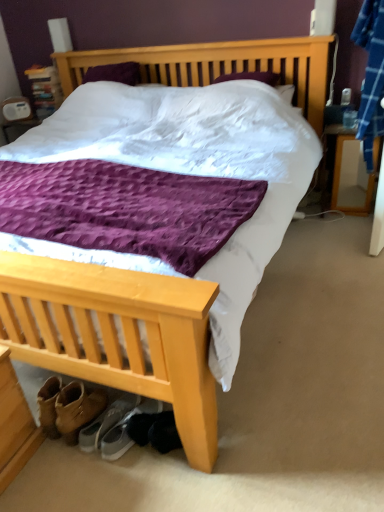
Question: From a real-world perspective, is wooden nightstand at right under gray fabric sneakers at lower center, which is the first footwear in right-to-left order?

Choices:
 (A) no
 (B) yes

Answer: (A)

Question: Is wooden nightstand at right turned away from gray fabric sneakers at lower center, placed as the 2th footwear when sorted from left to right?

Choices:
 (A) no
 (B) yes

Answer: (A)

Question: Does wooden nightstand at right turn towards gray fabric sneakers at lower center, placed as the 2th footwear when sorted from left to right?

Choices:
 (A) no
 (B) yes

Answer: (B)

Question: Considering the relative sizes of wooden nightstand at right and gray fabric sneakers at lower center, placed as the 2th footwear when sorted from left to right, in the image provided, is wooden nightstand at right taller than gray fabric sneakers at lower center, placed as the 2th footwear when sorted from left to right,?

Choices:
 (A) yes
 (B) no

Answer: (A)

Question: Is wooden nightstand at right shorter than gray fabric sneakers at lower center, placed as the 2th footwear when sorted from left to right?

Choices:
 (A) no
 (B) yes

Answer: (A)

Question: From their relative heights in the image, would you say wooden nightstand at right is taller or shorter than gray fabric sneakers at lower center, placed as the 2th footwear when sorted from left to right?

Choices:
 (A) tall
 (B) short

Answer: (A)

Question: In terms of width, does wooden nightstand at right look wider or thinner when compared to gray fabric sneakers at lower center, placed as the 2th footwear when sorted from left to right?

Choices:
 (A) thin
 (B) wide

Answer: (A)

Question: Is wooden nightstand at right situated inside gray fabric sneakers at lower center, placed as the 2th footwear when sorted from left to right, or outside?

Choices:
 (A) outside
 (B) inside

Answer: (A)

Question: Based on their sizes in the image, would you say wooden nightstand at right is bigger or smaller than gray fabric sneakers at lower center, placed as the 2th footwear when sorted from left to right?

Choices:
 (A) big
 (B) small

Answer: (A)

Question: Choose the correct answer: Is wooden nightstand at right inside gray suede sneakers at lower left, positioned as the first footwear in left-to-right order, or outside it?

Choices:
 (A) inside
 (B) outside

Answer: (B)

Question: From their relative heights in the image, would you say wooden nightstand at right is taller or shorter than gray suede sneakers at lower left, positioned as the first footwear in left-to-right order?

Choices:
 (A) short
 (B) tall

Answer: (B)

Question: Considering their positions, is wooden nightstand at right located in front of or behind gray suede sneakers at lower left, the second footwear from the right?

Choices:
 (A) behind
 (B) front

Answer: (A)

Question: Is wooden nightstand at right bigger or smaller than gray suede sneakers at lower left, positioned as the first footwear in left-to-right order?

Choices:
 (A) big
 (B) small

Answer: (A)

Question: Is gray suede sneakers at lower left, positioned as the first footwear in left-to-right order, in front of or behind gray fabric sneakers at lower center, which is the first footwear in right-to-left order, in the image?

Choices:
 (A) behind
 (B) front

Answer: (A)

Question: Is gray suede sneakers at lower left, positioned as the first footwear in left-to-right order, spatially inside gray fabric sneakers at lower center, placed as the 2th footwear when sorted from left to right, or outside of it?

Choices:
 (A) inside
 (B) outside

Answer: (B)